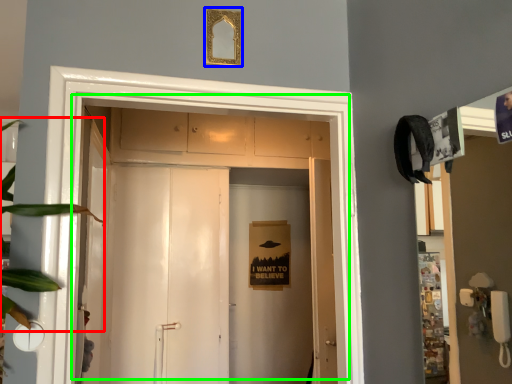
Question: Which object is positioned closest to plant (highlighted by a red box)? Select from picture frame (highlighted by a blue box) and door (highlighted by a green box).

Choices:
 (A) picture frame
 (B) door

Answer: (A)